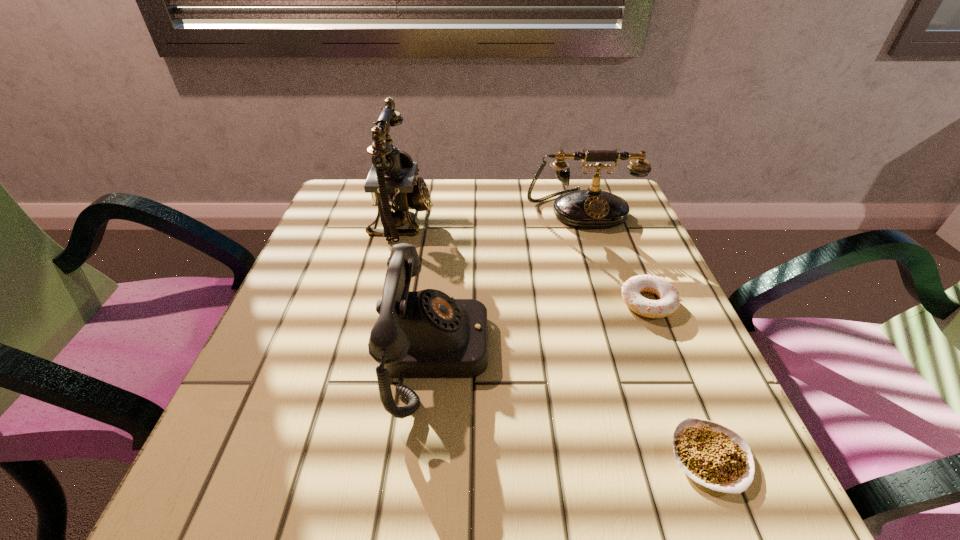
Find the location of a particular element. The image size is (960, 540). object that is at the near edge is located at coordinates (712, 455).

What are the coordinates of `object that is positioned at the left edge` in the screenshot? It's located at (392, 182).

Find the location of a particular element. This screenshot has width=960, height=540. telephone that is at the right edge is located at coordinates (593, 208).

Locate an element on the screen. doughnut that is at the right edge is located at coordinates (669, 301).

Image resolution: width=960 pixels, height=540 pixels. Find the location of `legume that is at the right edge`. legume that is at the right edge is located at coordinates (712, 455).

This screenshot has width=960, height=540. I want to click on object positioned at the far left corner, so 392,182.

Identify the location of object that is at the far right corner. The height and width of the screenshot is (540, 960). (593, 208).

You are a GUI agent. You are given a task and a screenshot of the screen. Output one action in this format:
    pyautogui.click(x=<x>, y=<y>)
    Task: Click on the object that is at the near right corner
    This screenshot has height=540, width=960.
    Given the screenshot: What is the action you would take?
    pyautogui.click(x=712, y=455)

In the image, there is a desktop. At what (x,y) coordinates should I click in order to perform the action: click on free region at the far edge. Please return your answer as a coordinate pair (x, y). This screenshot has width=960, height=540. Looking at the image, I should click on (551, 211).

Identify the location of vacant space at the near edge. The width and height of the screenshot is (960, 540). (481, 485).